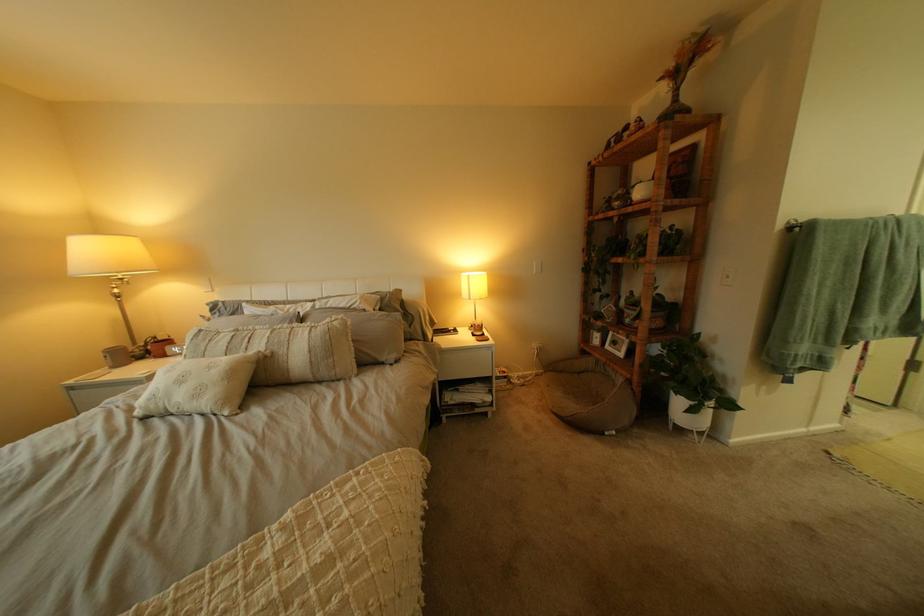
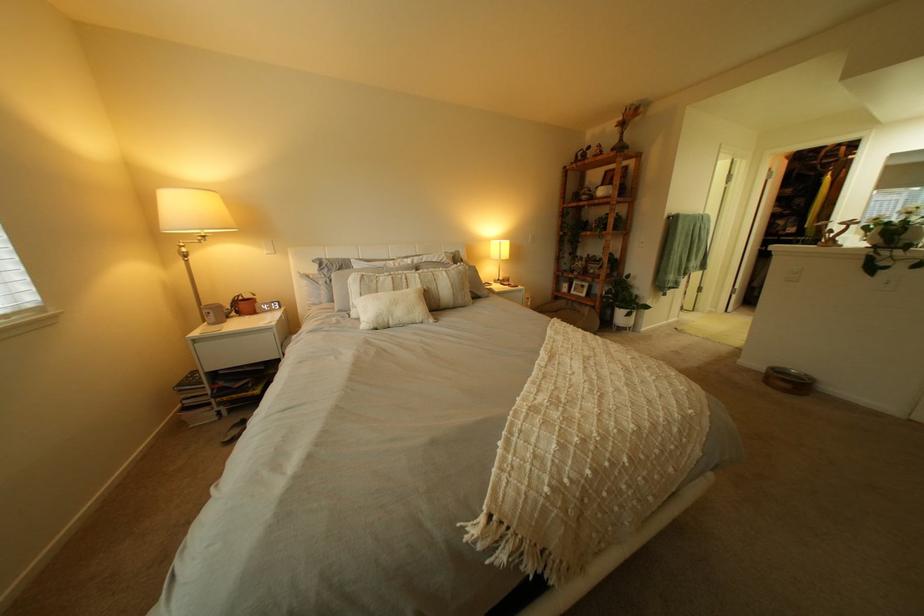
Where in the second image is the point corresponding to (176,405) from the first image?

(400, 320)